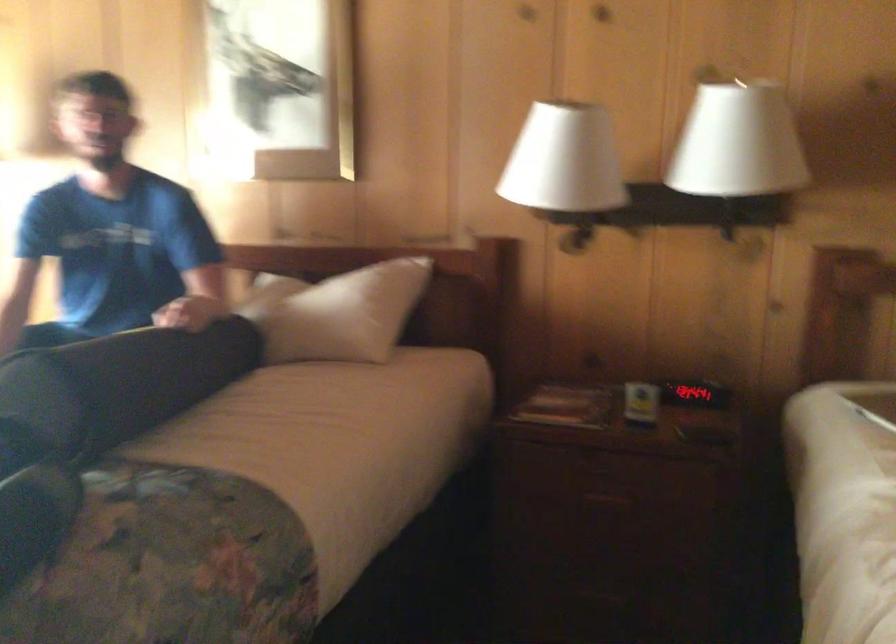
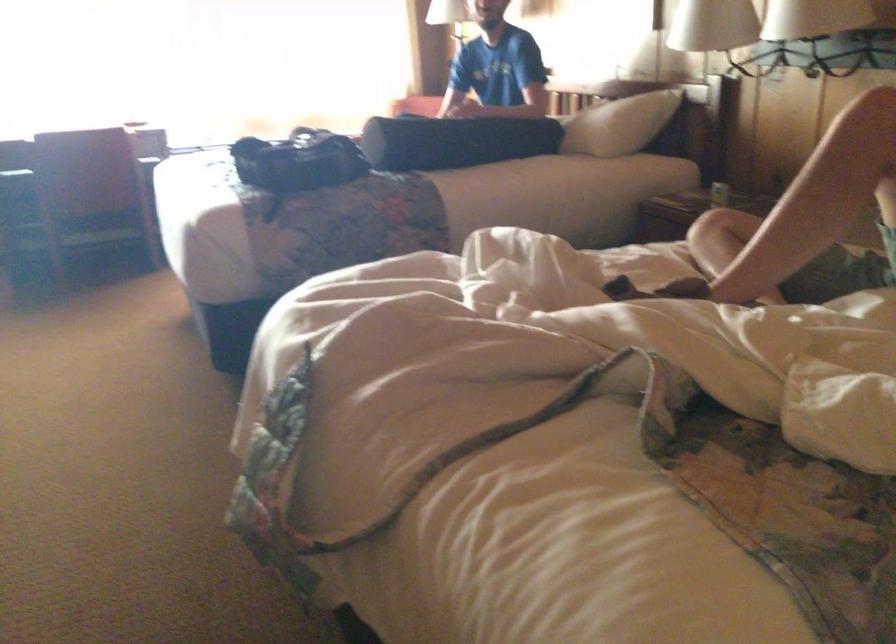
Find the pixel in the second image that matches pixel 686 413 in the first image.

(719, 194)